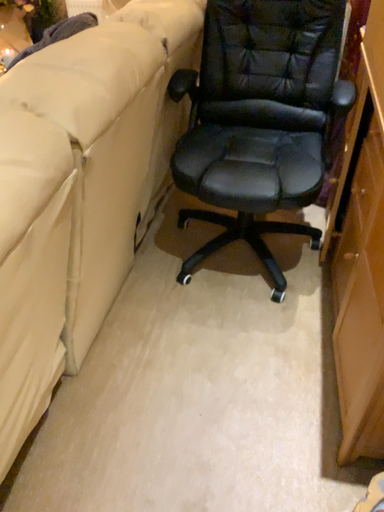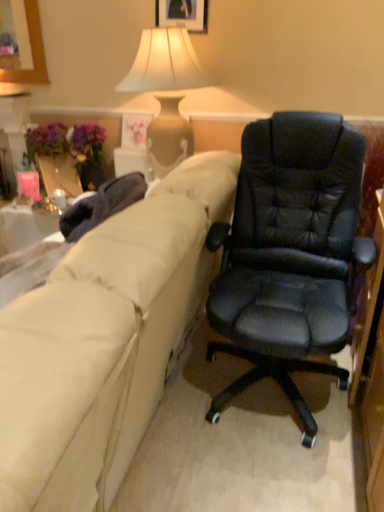
Question: How did the camera likely rotate when shooting the video?

Choices:
 (A) rotated downward
 (B) rotated upward

Answer: (B)